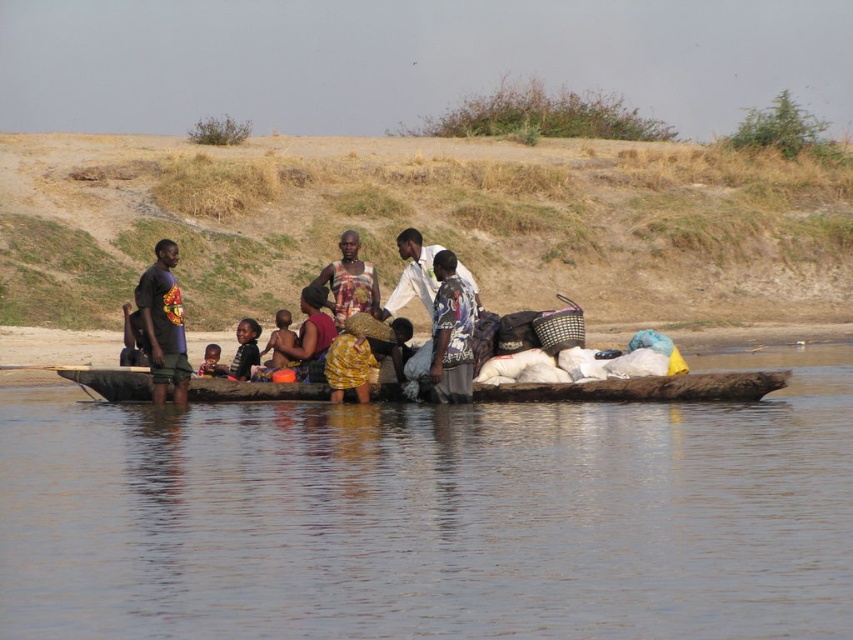
Is brown wooden canoe at center to the right of matte black t-shirt at left from the viewer's perspective?

Yes, brown wooden canoe at center is to the right of matte black t-shirt at left.

Which of these two, brown wooden canoe at center or matte black t-shirt at left, stands shorter?

With less height is brown wooden canoe at center.

Identify the location of brown wooden canoe at center. (643, 388).

Consider the image. Is brown wooden boat at center to the left of brown wooden canoe at center from the viewer's perspective?

Incorrect, brown wooden boat at center is not on the left side of brown wooden canoe at center.

Is point (503, 416) positioned after point (676, 396)?

Yes.

You are a GUI agent. You are given a task and a screenshot of the screen. Output one action in this format:
    pyautogui.click(x=<x>, y=<y>)
    Task: Click on the brown wooden boat at center
    
    Given the screenshot: What is the action you would take?
    pyautogui.click(x=433, y=515)

Who is taller, brown wooden canoe at center or printed fabric dress at center?

printed fabric dress at center

Who is more forward, (527,392) or (350,266)?

Point (527,392) is in front.

Locate an element on the screen. This screenshot has height=640, width=853. brown wooden canoe at center is located at coordinates (643, 388).

Where is `brown wooden canoe at center`? The height and width of the screenshot is (640, 853). brown wooden canoe at center is located at coordinates (643, 388).